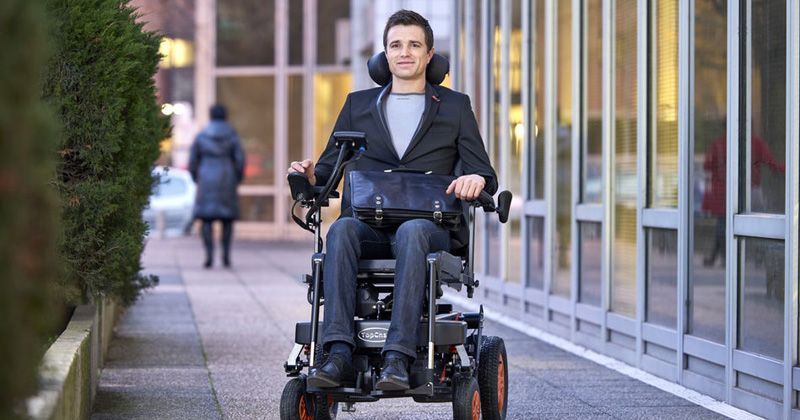
At what (x,y) coordinates should I click in order to perform the action: click on footrest. Please return your answer as a coordinate pair (x, y). This screenshot has height=420, width=800. Looking at the image, I should click on (414, 388), (338, 388).